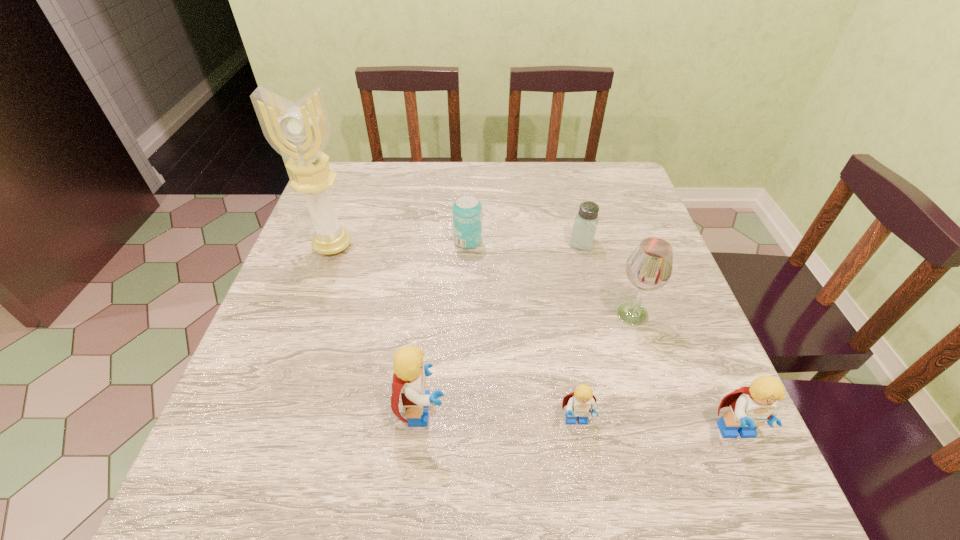
The image size is (960, 540). I want to click on vacant area that satisfies the following two spatial constraints: 1. on the front side of the saltshaker; 2. on the front-facing side of the leftmost Lego, so point(624,410).